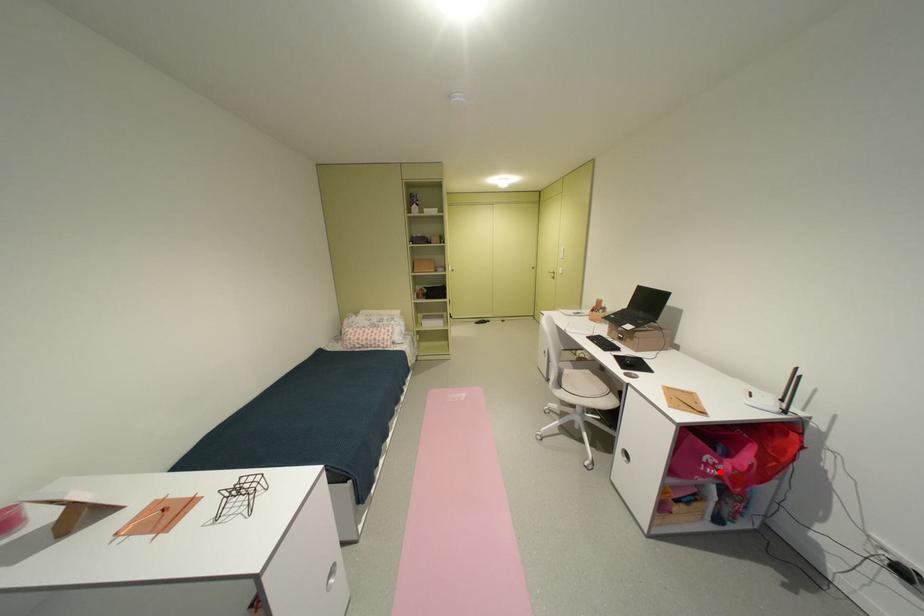
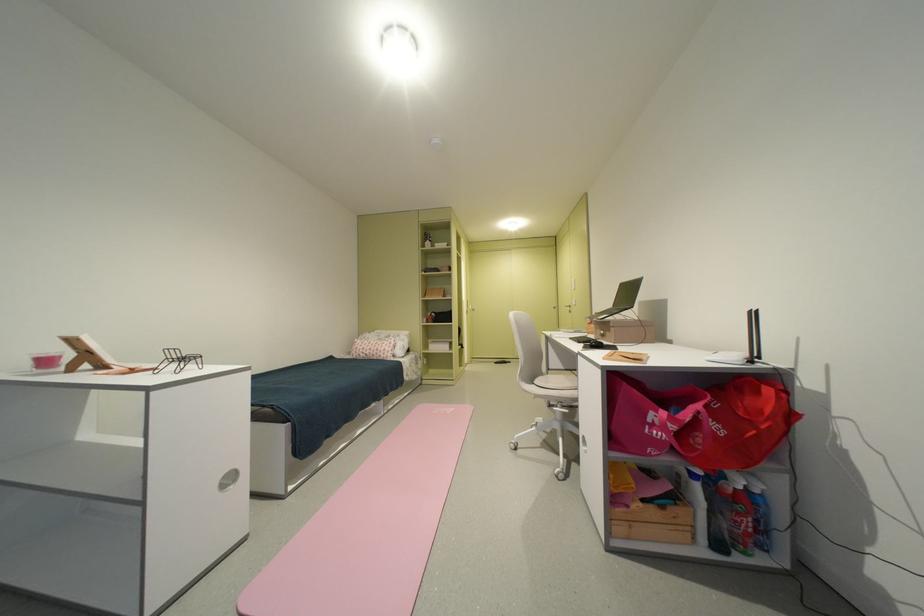
Find the pixel in the second image that matches the highlighted location in the first image.

(665, 432)